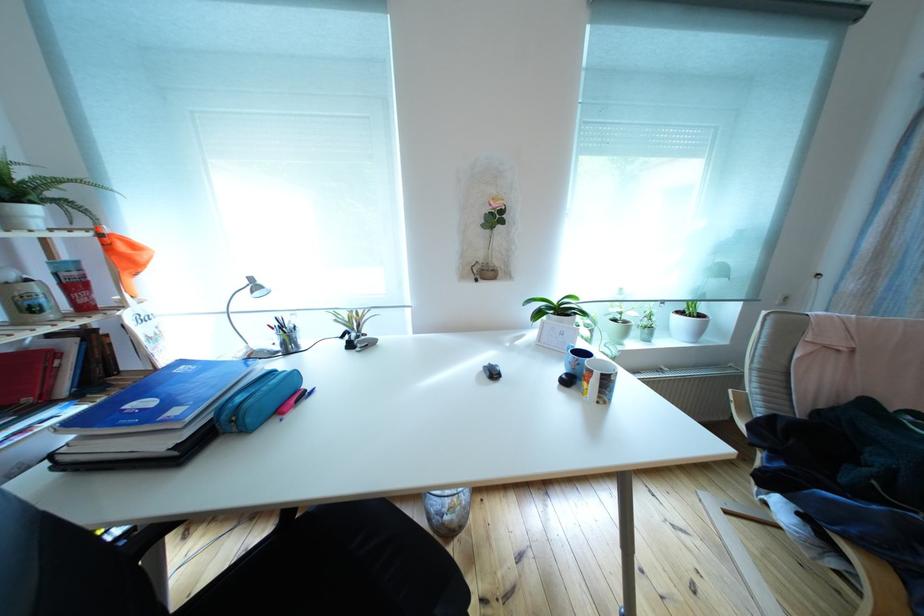
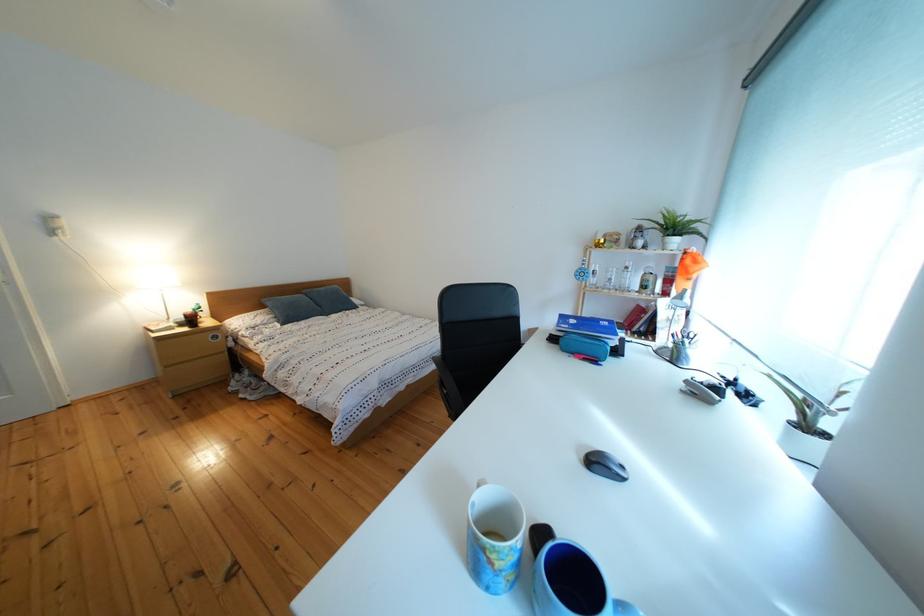
In the second image, find the point that corresponds to pixel 134 253 in the first image.

(699, 267)